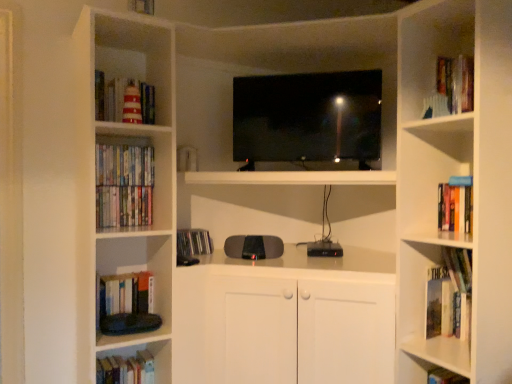
The width and height of the screenshot is (512, 384). In order to click on free point below hardcover book at left, which is the 5th book from top to bottom (from a real-world perspective) in this screenshot , I will do `click(120, 360)`.